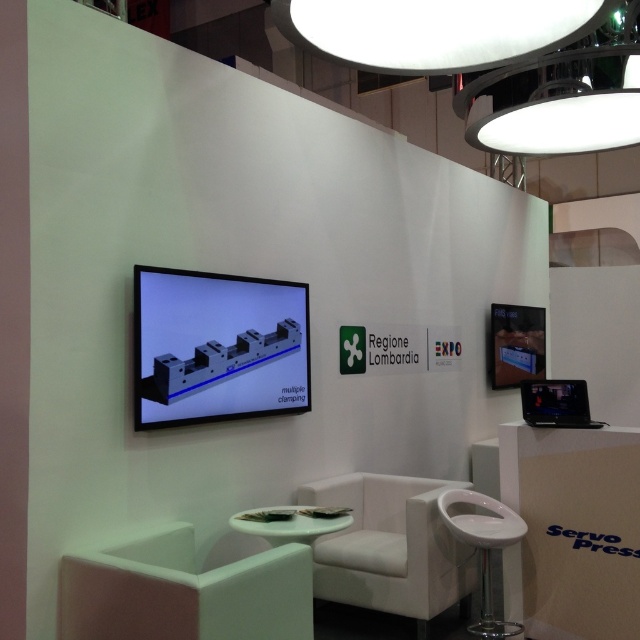
Describe the element at coordinates (388, 547) in the screenshot. I see `white fabric chair at center` at that location.

Is white fabric chair at center to the right of white plastic stool at lower right from the viewer's perspective?

No, white fabric chair at center is not to the right of white plastic stool at lower right.

What do you see at coordinates (388, 547) in the screenshot? This screenshot has width=640, height=640. I see `white fabric chair at center` at bounding box center [388, 547].

I want to click on white fabric chair at center, so click(388, 547).

Can you confirm if white matte chair at lower left is thinner than white plastic stool at lower right?

No, white matte chair at lower left is not thinner than white plastic stool at lower right.

Is point (147, 608) positioned after point (436, 500)?

That is False.

Locate an element on the screen. This screenshot has height=640, width=640. white matte chair at lower left is located at coordinates (182, 593).

Who is positioned more to the left, white matte chair at lower left or white fabric chair at center?

From the viewer's perspective, white matte chair at lower left appears more on the left side.

Is white matte chair at lower left below white fabric chair at center?

Actually, white matte chair at lower left is above white fabric chair at center.

You are a GUI agent. You are given a task and a screenshot of the screen. Output one action in this format:
    pyautogui.click(x=<x>, y=<y>)
    Task: Click on the white matte chair at lower left
    Image resolution: width=640 pixels, height=640 pixels.
    Given the screenshot: What is the action you would take?
    pyautogui.click(x=182, y=593)